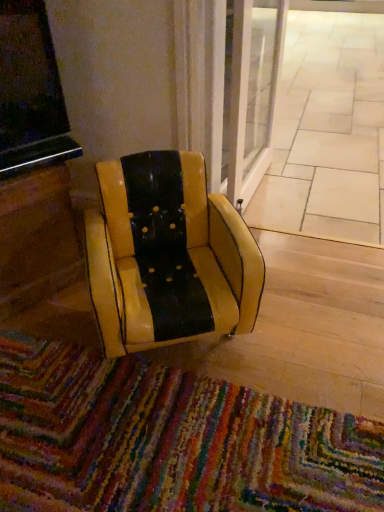
Identify the location of free spot to the right of yellow leather chair at center. (312, 320).